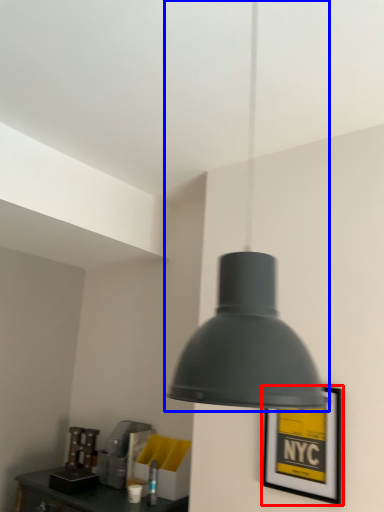
Question: Among these objects, which one is farthest to the camera, picture frame (highlighted by a red box) or lamp (highlighted by a blue box)?

Choices:
 (A) picture frame
 (B) lamp

Answer: (A)